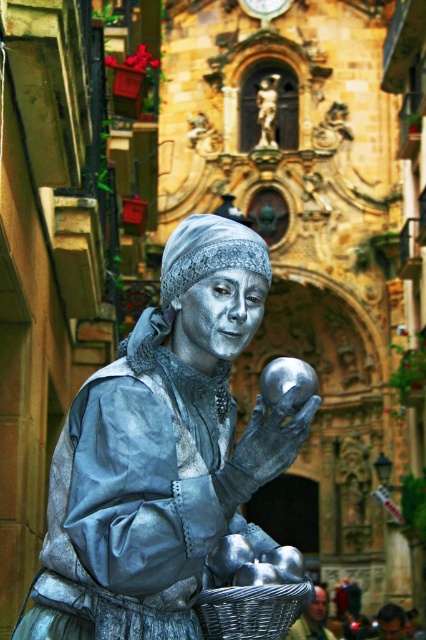
Question: Does shiny silver statue at center have a greater width compared to metallic woven basket at lower center?

Choices:
 (A) no
 (B) yes

Answer: (B)

Question: From the image, what is the correct spatial relationship of shiny silver statue at center in relation to metallic woven basket at lower center?

Choices:
 (A) above
 (B) below

Answer: (A)

Question: Which of the following is the farthest from the observer?

Choices:
 (A) polished bronze statue at center
 (B) metallic woven basket at lower center
 (C) shiny silver statue at center

Answer: (A)

Question: Does metallic woven basket at lower center have a smaller size compared to polished bronze statue at center?

Choices:
 (A) no
 (B) yes

Answer: (A)

Question: Which object appears farthest from the camera in this image?

Choices:
 (A) metallic woven basket at lower center
 (B) polished bronze statue at center

Answer: (B)

Question: Among these points, which one is farthest from the camera?

Choices:
 (A) (196, 605)
 (B) (264, 140)

Answer: (B)